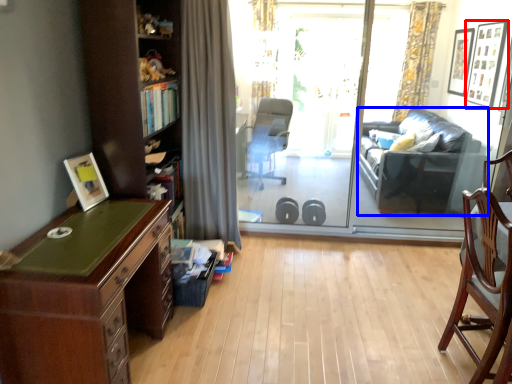
Question: Which object is further to the camera taking this photo, picture frame (highlighted by a red box) or studio couch (highlighted by a blue box)?

Choices:
 (A) picture frame
 (B) studio couch

Answer: (A)